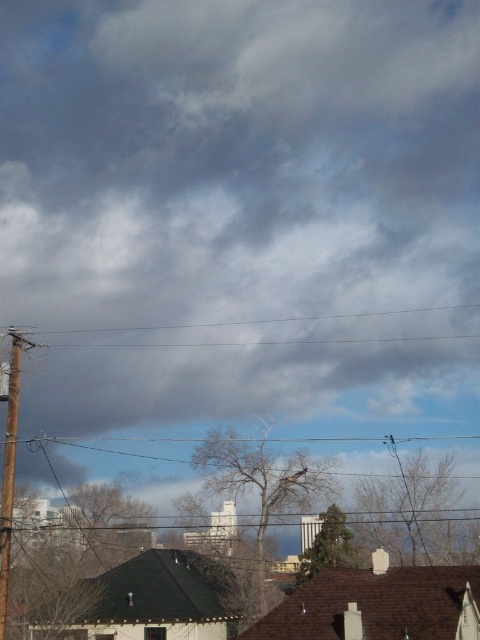
Does brown wooden telegraph pole at left lie behind wooden post at left?

No.

Does brown wooden telegraph pole at left have a lesser width compared to wooden post at left?

Incorrect, brown wooden telegraph pole at left's width is not less than wooden post at left's.

I want to click on brown wooden telegraph pole at left, so click(9, 472).